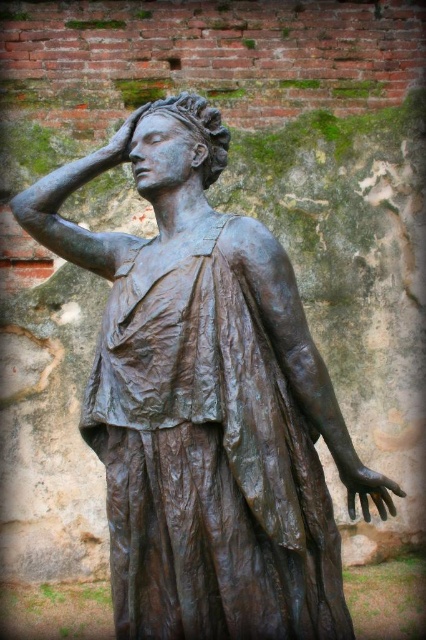
You are standing in front of the bronze statue and looking at the two points marked on the image. Which point, point (210,163) or point (337,460), is closer to you?

Point (210,163) is further to the camera than point (337,460), so the point closer to you is point (337,460).

You are an art conservator examining the bronze statue. You notice a specific point at coordinates (365, 484). Based on the statue description, where is this point located?

The point at coordinates (365, 484) is on the bronze hand at center.